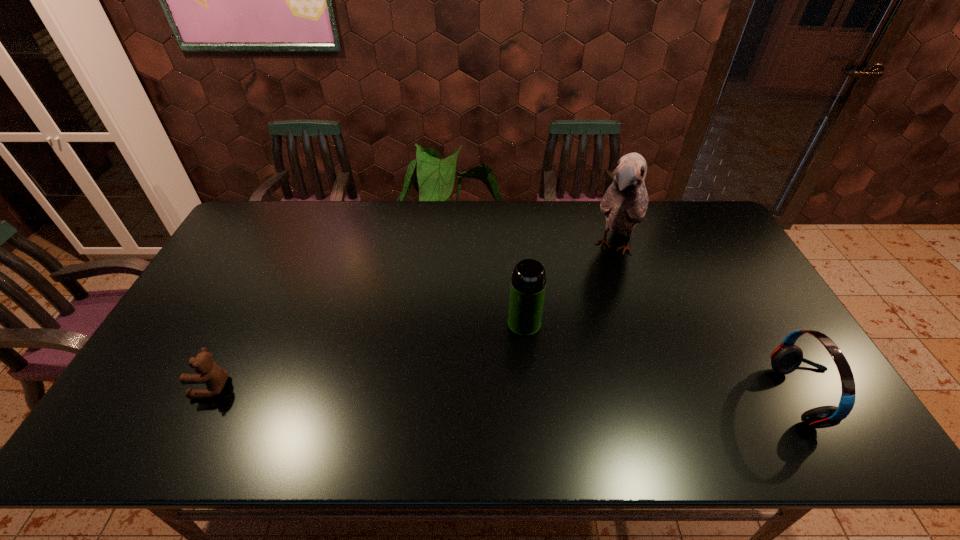
Find the location of a particular element. This screenshot has width=960, height=540. vacant point located 0.150m on the front-facing side of the third object from left to right is located at coordinates (597, 306).

Locate an element on the screen. This screenshot has height=540, width=960. free region located 0.400m on the front-facing side of the third object from left to right is located at coordinates (568, 369).

What are the coordinates of `free region located on the front-facing side of the third object from left to right` in the screenshot? It's located at (601, 297).

Find the location of `vacant region located from the spout of the third object from right to left`. vacant region located from the spout of the third object from right to left is located at coordinates (449, 396).

Find the location of a particular element. vacant space situated from the spout of the third object from right to left is located at coordinates (463, 382).

Where is `free region located from the spout of the third object from right to left`? This screenshot has height=540, width=960. free region located from the spout of the third object from right to left is located at coordinates (444, 401).

At what (x,y) coordinates should I click in order to perform the action: click on object that is at the far edge. Please return your answer as a coordinate pair (x, y). Looking at the image, I should click on (625, 202).

At what (x,y) coordinates should I click in order to perform the action: click on teddy bear at the near edge. Please return your answer as a coordinate pair (x, y). Looking at the image, I should click on (207, 371).

Find the location of a particular element. The width and height of the screenshot is (960, 540). headset positioned at the near edge is located at coordinates (785, 359).

Find the location of a particular element. Image resolution: width=960 pixels, height=540 pixels. object situated at the left edge is located at coordinates (207, 371).